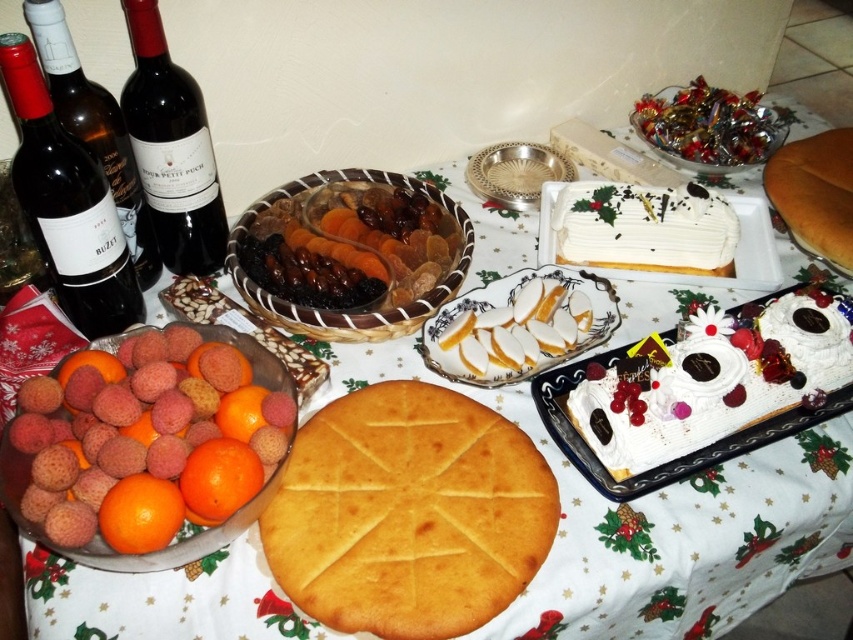
Question: Is pink matte lychees at lower left above white glossy platter at center?

Choices:
 (A) no
 (B) yes

Answer: (A)

Question: Which of the following is the farthest from the observer?

Choices:
 (A) matte glass bottle at left
 (B) white cream cake at center
 (C) golden brown crust at center
 (D) pink matte lychees at lower left

Answer: (B)

Question: Does dried fruit basket at center appear on the left side of matte glass bottle at left?

Choices:
 (A) yes
 (B) no

Answer: (B)

Question: Which point appears farthest from the camera in this image?

Choices:
 (A) (1, 476)
 (B) (798, 408)

Answer: (B)

Question: Which point is closer to the camera?

Choices:
 (A) white cream cake at lower right
 (B) pink matte lychees at lower left

Answer: (B)

Question: Does white cream cake at center appear on the right side of matte glass bottle at left?

Choices:
 (A) no
 (B) yes

Answer: (B)